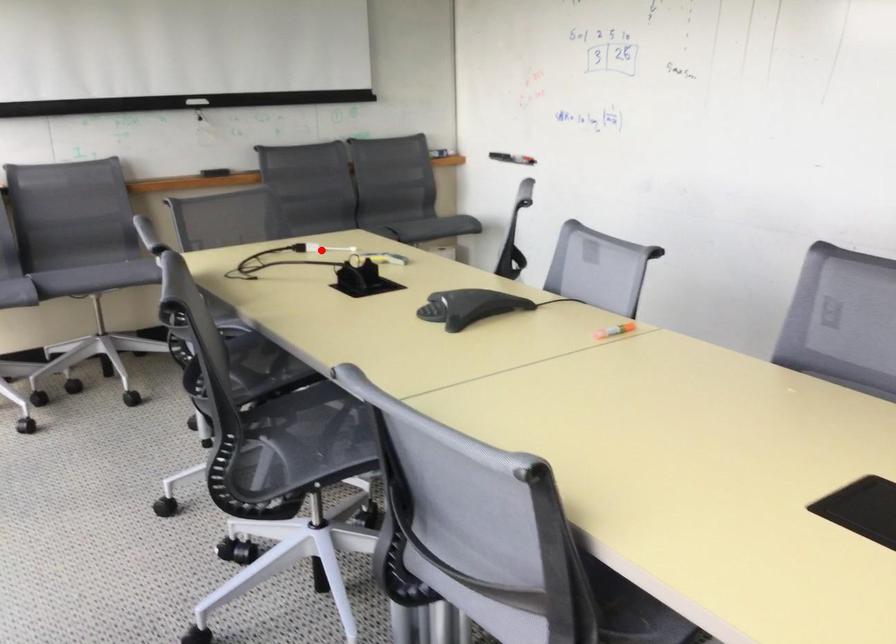
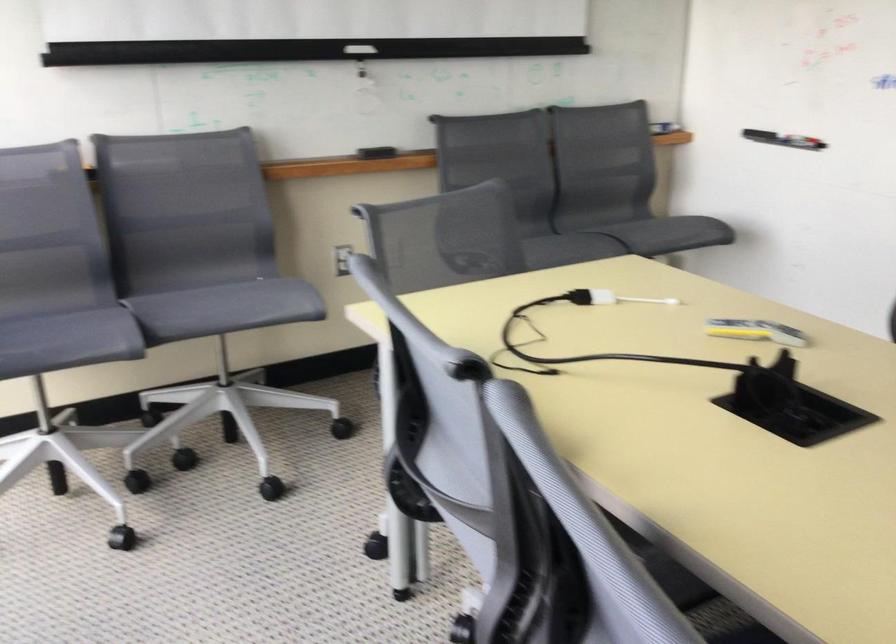
Find the pixel in the second image that matches the highlighted location in the first image.

(610, 298)